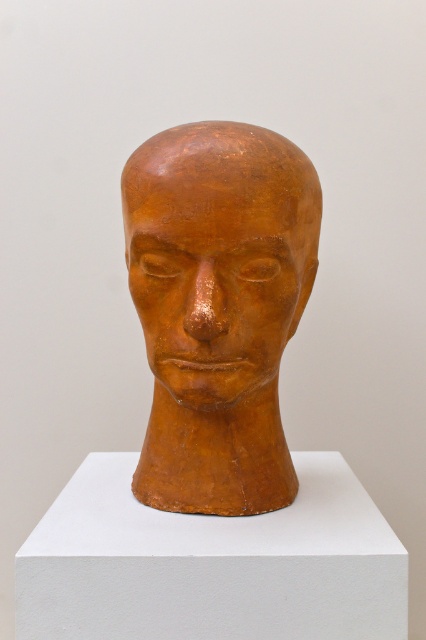
Is matte orange head at center bigger than matte clay face at center?

Yes, matte orange head at center is bigger than matte clay face at center.

Can you confirm if matte orange head at center is positioned to the right of matte clay face at center?

Incorrect, matte orange head at center is not on the right side of matte clay face at center.

This screenshot has width=426, height=640. What do you see at coordinates (218, 308) in the screenshot?
I see `matte orange head at center` at bounding box center [218, 308].

Identify the location of matte orange head at center. (218, 308).